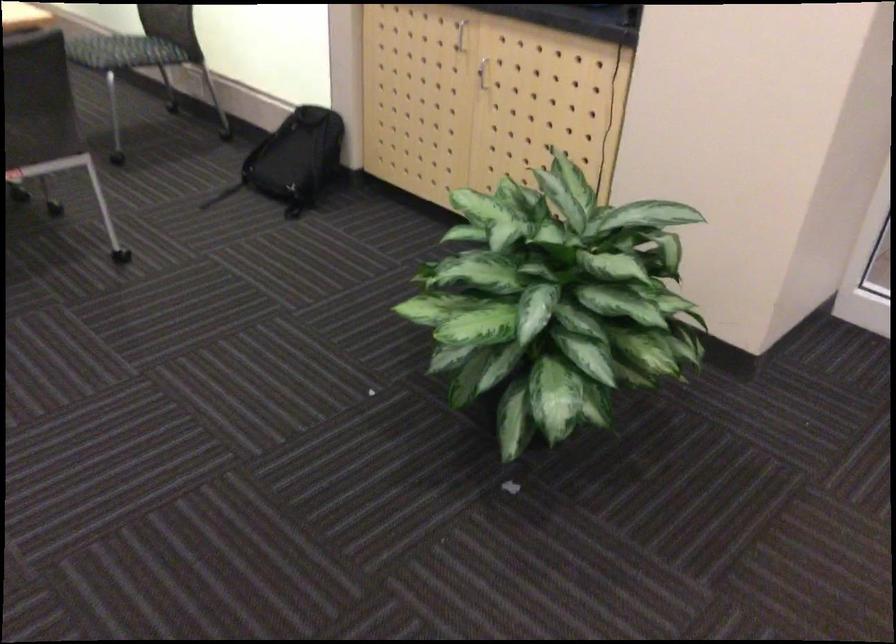
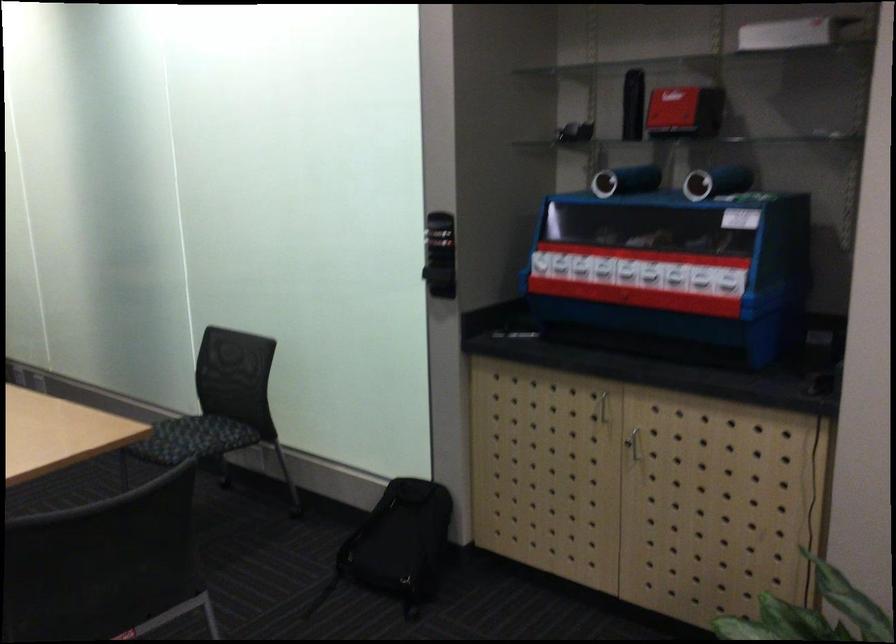
Find the pixel in the second image that matches (282,160) in the first image.

(398, 545)